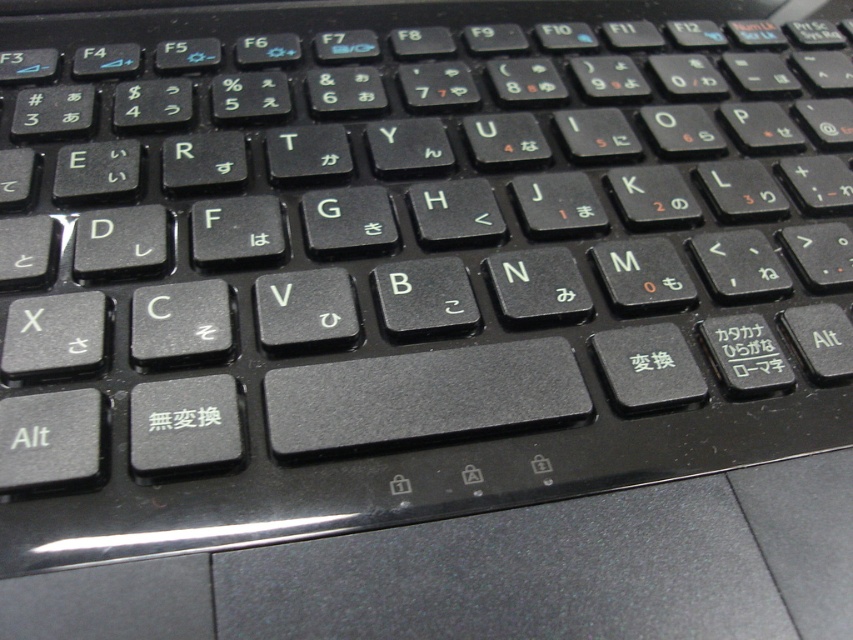
Is point (202, 115) positioned after point (149, 413)?

Yes, it is.

Which is in front, point (263, 147) or point (170, 419)?

Positioned in front is point (170, 419).

Identify the location of black matte keyboard at center. (418, 237).